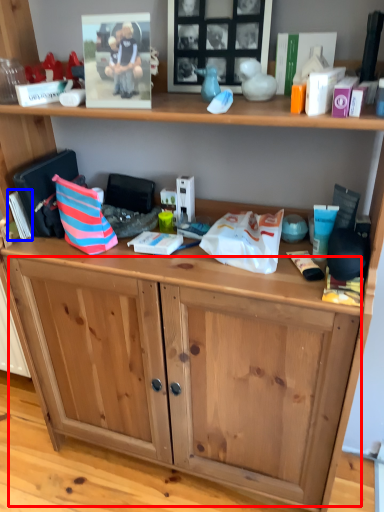
Question: Among these objects, which one is nearest to the camera, drawer (highlighted by a red box) or book (highlighted by a blue box)?

Choices:
 (A) drawer
 (B) book

Answer: (A)